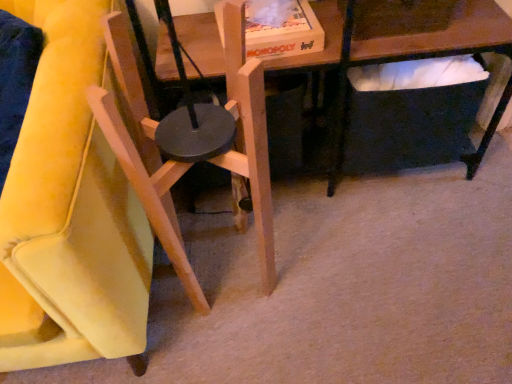
Find the location of a particular element. This screenshot has height=384, width=512. space that is in front of natural wood chair at center, positioned as the first chair in right-to-left order is located at coordinates coord(230,342).